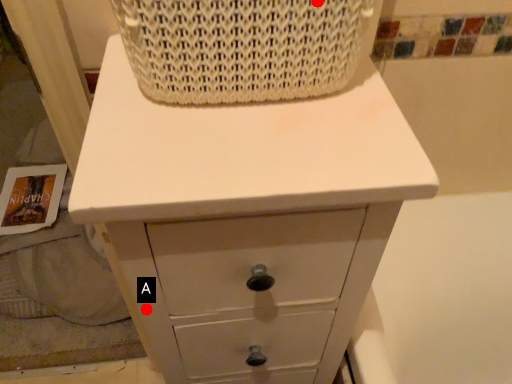
Question: Two points are circled on the image, labeled by A and B beside each circle. Which point appears farthest from the camera in this image?

Choices:
 (A) A is further
 (B) B is further

Answer: (A)